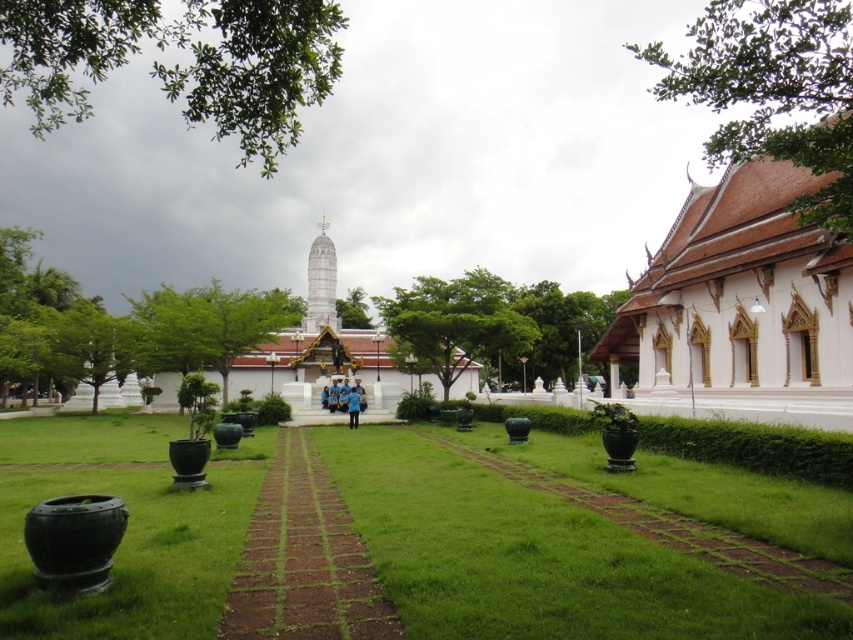
Question: Which is farther from the white painted wood palace at right?

Choices:
 (A) green matte planter at center
 (B) white smooth stupa at center
 (C) green brick path at center

Answer: (C)

Question: Which is nearer to the white smooth stupa at center?

Choices:
 (A) green brick path at center
 (B) green matte planter at center
 (C) white painted wood palace at right

Answer: (C)

Question: Which object is closer to the camera taking this photo?

Choices:
 (A) white smooth stupa at center
 (B) white painted wood palace at right
 (C) green brick path at center

Answer: (C)

Question: Can you confirm if green matte planter at center is positioned above white painted wood palace at right?

Choices:
 (A) yes
 (B) no

Answer: (B)

Question: Where is white painted wood palace at right located in relation to green brick path at center in the image?

Choices:
 (A) left
 (B) right

Answer: (B)

Question: In this image, where is white painted wood palace at right located relative to green brick path at center?

Choices:
 (A) right
 (B) left

Answer: (A)